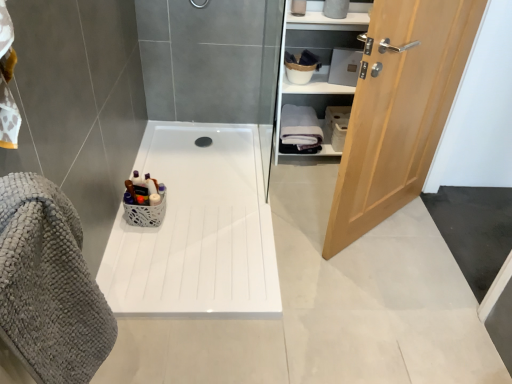
This screenshot has height=384, width=512. I want to click on black rubber drain at center, so click(203, 141).

You are a GUI agent. You are given a task and a screenshot of the screen. Output one action in this format:
    pyautogui.click(x=<x>, y=<y>)
    Task: Click on the white glossy cabinet at upper right
    
    Given the screenshot: What is the action you would take?
    pyautogui.click(x=321, y=53)

Describe the element at coordinates (321, 53) in the screenshot. The height and width of the screenshot is (384, 512). I see `white glossy cabinet at upper right` at that location.

Image resolution: width=512 pixels, height=384 pixels. Find the location of `gray textured bath towel at left, which appears as the second bath towel when viewed from the back`. gray textured bath towel at left, which appears as the second bath towel when viewed from the back is located at coordinates (49, 284).

What do you see at coordinates (300, 130) in the screenshot?
I see `white cotton bath towel at right, which ranks as the 1th bath towel in back-to-front order` at bounding box center [300, 130].

This screenshot has width=512, height=384. Describe the element at coordinates (197, 229) in the screenshot. I see `white glossy bath at center` at that location.

What is the approximate width of light wood door at right?

light wood door at right is 20.26 centimeters wide.

Where is `black rubber drain at center`? This screenshot has width=512, height=384. black rubber drain at center is located at coordinates (203, 141).

How many degrees apart are the facing directions of white cotton bath towel at right, which is the 2th bath towel from left to right, and white glossy cabinet at upper right?

0.284 degrees separate the facing orientations of white cotton bath towel at right, which is the 2th bath towel from left to right, and white glossy cabinet at upper right.

Is white cotton bath towel at right, the first bath towel positioned from the right, with white glossy cabinet at upper right?

white cotton bath towel at right, the first bath towel positioned from the right, is not next to white glossy cabinet at upper right, and they're not touching.

From a real-world perspective, does white cotton bath towel at right, marked as the first bath towel in a top-to-bottom arrangement, sit lower than white glossy cabinet at upper right?

Yes.

Looking at this image, can you confirm if white cotton bath towel at right, the first bath towel positioned from the right, is smaller than white glossy cabinet at upper right?

Indeed, white cotton bath towel at right, the first bath towel positioned from the right, has a smaller size compared to white glossy cabinet at upper right.

Can you confirm if black rubber drain at center is bigger than white glossy bath at center?

No, black rubber drain at center is not bigger than white glossy bath at center.

From the image's perspective, between black rubber drain at center and white glossy bath at center, who is located below?

white glossy bath at center is shown below in the image.

Is black rubber drain at center positioned far away from white glossy bath at center?

No, black rubber drain at center is not far from white glossy bath at center.

Could white glossy bath at center be considered to be inside black rubber drain at center?

No, white glossy bath at center is located outside of black rubber drain at center.

Does white glossy bath at center lie behind light wood door at right?

Yes, white glossy bath at center is further from the viewer.

Which is correct: white glossy bath at center is inside light wood door at right, or outside of it?

white glossy bath at center is not inside light wood door at right, it's outside.

Is point (226, 204) in front of point (335, 205)?

No, it is behind (335, 205).

Looking at this image, considering the sizes of objects white glossy bath at center and light wood door at right in the image provided, who is shorter, white glossy bath at center or light wood door at right?

Standing shorter between the two is white glossy bath at center.

Is white glossy cabinet at upper right touching black rubber drain at center?

white glossy cabinet at upper right and black rubber drain at center are clearly separated.

From the image's perspective, is white glossy cabinet at upper right under black rubber drain at center?

Incorrect, from the image's perspective, white glossy cabinet at upper right is higher than black rubber drain at center.

Which is correct: white glossy cabinet at upper right is inside black rubber drain at center, or outside of it?

white glossy cabinet at upper right exists outside the volume of black rubber drain at center.

At what (x,y) coordinates should I click in order to perform the action: click on closet that appears above the black rubber drain at center (from a real-world perspective). Please return your answer as a coordinate pair (x, y). The height and width of the screenshot is (384, 512). Looking at the image, I should click on (321, 53).

Based on the photo, is white cotton bath towel at right, which is counted as the 2th bath towel, starting from the bottom, aimed at gray textured bath towel at left, the 2th bath towel positioned from the right?

Yes, white cotton bath towel at right, which is counted as the 2th bath towel, starting from the bottom, faces towards gray textured bath towel at left, the 2th bath towel positioned from the right.

Where is `bath towel lying on the left of white cotton bath towel at right, which is counted as the 2th bath towel, starting from the bottom`? bath towel lying on the left of white cotton bath towel at right, which is counted as the 2th bath towel, starting from the bottom is located at coordinates (49, 284).

Does white cotton bath towel at right, the first bath towel positioned from the right, contain gray textured bath towel at left, the 1th bath towel positioned from the front?

No, gray textured bath towel at left, the 1th bath towel positioned from the front, is located outside of white cotton bath towel at right, the first bath towel positioned from the right.

Which object is positioned more to the right, white cotton bath towel at right, which ranks as the 2th bath towel in front-to-back order, or gray textured bath towel at left, the 1th bath towel when ordered from bottom to top?

Positioned to the right is white cotton bath towel at right, which ranks as the 2th bath towel in front-to-back order.

Who is more distant, gray textured bath towel at left, the 1th bath towel positioned from the front, or white glossy bath at center?

white glossy bath at center is further away from the camera.

Is gray textured bath towel at left, the 2th bath towel positioned from the right, inside the boundaries of white glossy bath at center, or outside?

gray textured bath towel at left, the 2th bath towel positioned from the right, exists outside the volume of white glossy bath at center.

Is point (12, 264) less distant than point (178, 261)?

Yes, it is.

Can you tell me how much light wood door at right and white glossy cabinet at upper right differ in facing direction?

The angular difference between light wood door at right and white glossy cabinet at upper right is 40.3 degrees.

Is light wood door at right wider or thinner than white glossy cabinet at upper right?

Clearly, light wood door at right has less width compared to white glossy cabinet at upper right.

Based on the photo, considering the relative sizes of light wood door at right and white glossy cabinet at upper right in the image provided, is light wood door at right shorter than white glossy cabinet at upper right?

No, light wood door at right is not shorter than white glossy cabinet at upper right.

From a real-world perspective, is light wood door at right physically below white glossy cabinet at upper right?

Actually, light wood door at right is physically above white glossy cabinet at upper right in the real world.

In order to click on the 1st bath towel positioned below the white glossy cabinet at upper right (from the image's perspective) in this screenshot , I will do `click(300, 130)`.

Where is `drain behind the white glossy bath at center`? drain behind the white glossy bath at center is located at coordinates (203, 141).

Which object lies further to the anchor point light wood door at right, white glossy cabinet at upper right or white cotton bath towel at right, which is the 2th bath towel from left to right?

Among the two, white cotton bath towel at right, which is the 2th bath towel from left to right, is located further to light wood door at right.

Consider the image. When comparing their distances from white glossy cabinet at upper right, does black rubber drain at center or white cotton bath towel at right, which ranks as the 1th bath towel in back-to-front order, seem further?

The object further to white glossy cabinet at upper right is black rubber drain at center.

Looking at the image, which one is located further to white glossy cabinet at upper right, light wood door at right or gray textured bath towel at left, which is counted as the second bath towel, starting from the top?

gray textured bath towel at left, which is counted as the second bath towel, starting from the top, is positioned further to the anchor white glossy cabinet at upper right.

When comparing their distances from light wood door at right, does white glossy cabinet at upper right or white glossy bath at center seem further?

white glossy bath at center is further to light wood door at right.

Considering their positions, is white cotton bath towel at right, which is the 2th bath towel from left to right, positioned closer to black rubber drain at center than white glossy bath at center?

white cotton bath towel at right, which is the 2th bath towel from left to right, is positioned closer to the anchor black rubber drain at center.

Which object lies nearer to the anchor point black rubber drain at center, white glossy cabinet at upper right or white glossy bath at center?

Based on the image, white glossy bath at center appears to be nearer to black rubber drain at center.

Considering their positions, is gray textured bath towel at left, the 2th bath towel positioned from the right, positioned further to black rubber drain at center than white glossy bath at center?

gray textured bath towel at left, the 2th bath towel positioned from the right, lies further to black rubber drain at center than the other object.

Looking at the image, which one is located further to white glossy bath at center, black rubber drain at center or gray textured bath towel at left, which appears as the second bath towel when viewed from the back?

gray textured bath towel at left, which appears as the second bath towel when viewed from the back, lies further to white glossy bath at center than the other object.

Locate an element on the screen. This screenshot has height=384, width=512. closet located between gray textured bath towel at left, the 2th bath towel positioned from the right, and white cotton bath towel at right, which ranks as the 2th bath towel in front-to-back order, in the depth direction is located at coordinates (321, 53).

You are a GUI agent. You are given a task and a screenshot of the screen. Output one action in this format:
    pyautogui.click(x=<x>, y=<y>)
    Task: Click on the door located between gray textured bath towel at left, which appears as the second bath towel when viewed from the back, and white glossy cabinet at upper right in the depth direction
    The image size is (512, 384).
    Given the screenshot: What is the action you would take?
    pyautogui.click(x=399, y=109)

The height and width of the screenshot is (384, 512). Identify the location of bath towel positioned between white glossy bath at center and black rubber drain at center from near to far. (300, 130).

Where is `bath between gray textured bath towel at left, the 1th bath towel positioned from the front, and white glossy cabinet at upper right from front to back`? The height and width of the screenshot is (384, 512). bath between gray textured bath towel at left, the 1th bath towel positioned from the front, and white glossy cabinet at upper right from front to back is located at coordinates (197, 229).